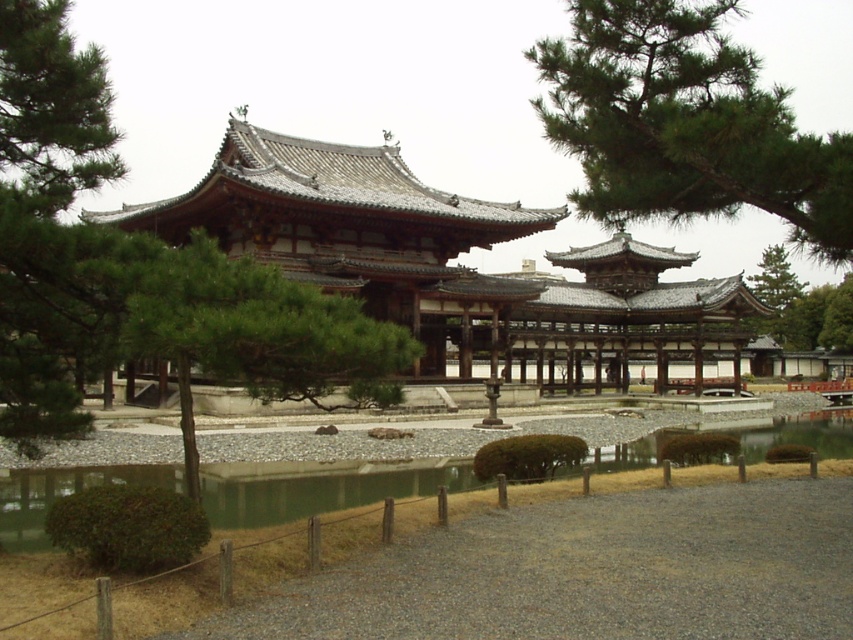
Question: Which of the following is the farthest from the observer?

Choices:
 (A) (154, 481)
 (B) (241, 246)
 (C) (141, 310)
 (D) (782, 122)

Answer: (B)

Question: Which object is positioned farthest from the green textured tree at center?

Choices:
 (A) shiny gray roof at center
 (B) green needle-like leaves at upper right
 (C) green water at center

Answer: (A)

Question: Estimate the real-world distances between objects in this image. Which object is closer to the green water at center?

Choices:
 (A) green needle-like leaves at upper right
 (B) green textured tree at center
 (C) green leafy tree at left

Answer: (B)

Question: Does green needle-like leaves at upper right appear under green textured tree at center?

Choices:
 (A) no
 (B) yes

Answer: (A)

Question: Can you confirm if green textured tree at center is positioned below green water at center?

Choices:
 (A) no
 (B) yes

Answer: (A)

Question: Does green needle-like leaves at upper right appear on the left side of green water at center?

Choices:
 (A) no
 (B) yes

Answer: (A)